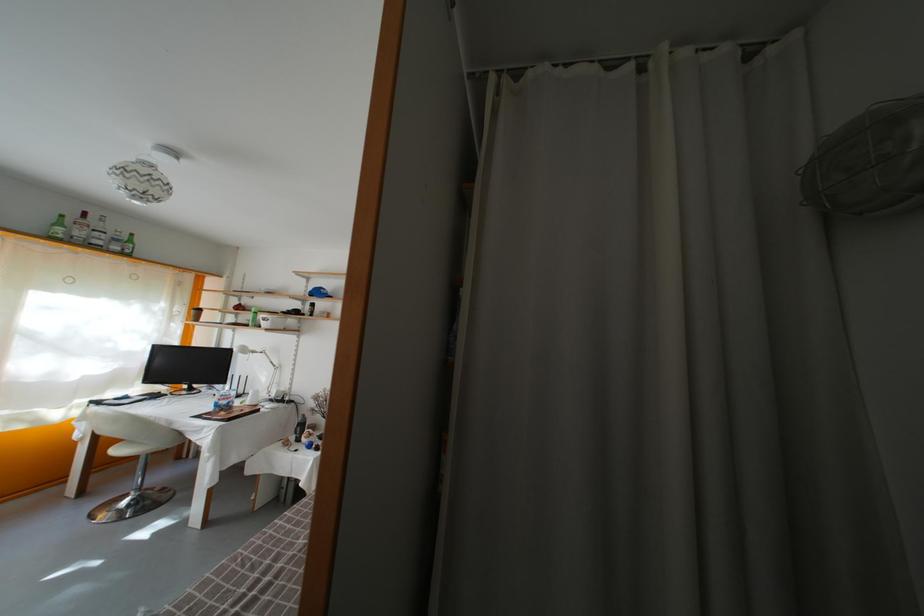
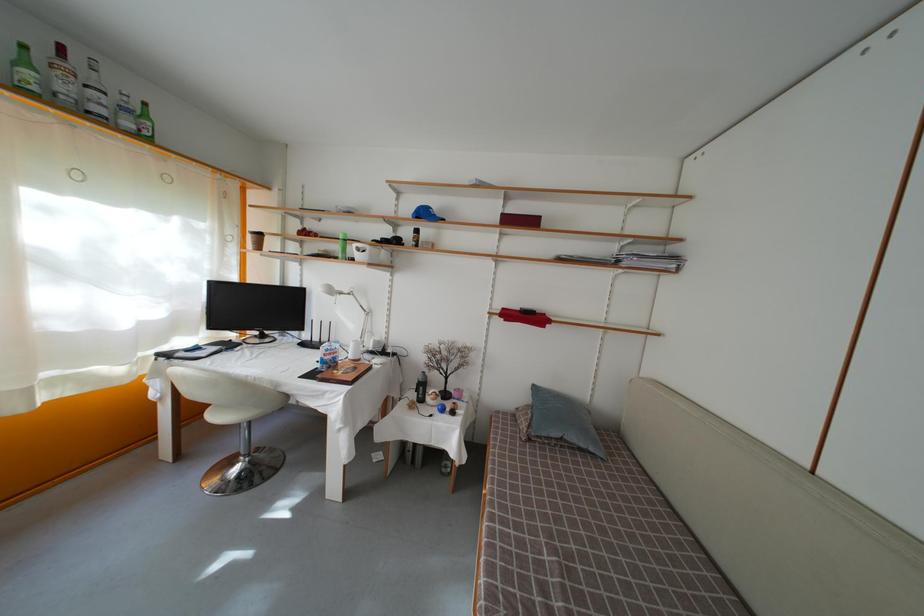
The images are taken continuously from a first-person perspective. In which direction are you moving?

The movement direction of the cameraman is left, forward.